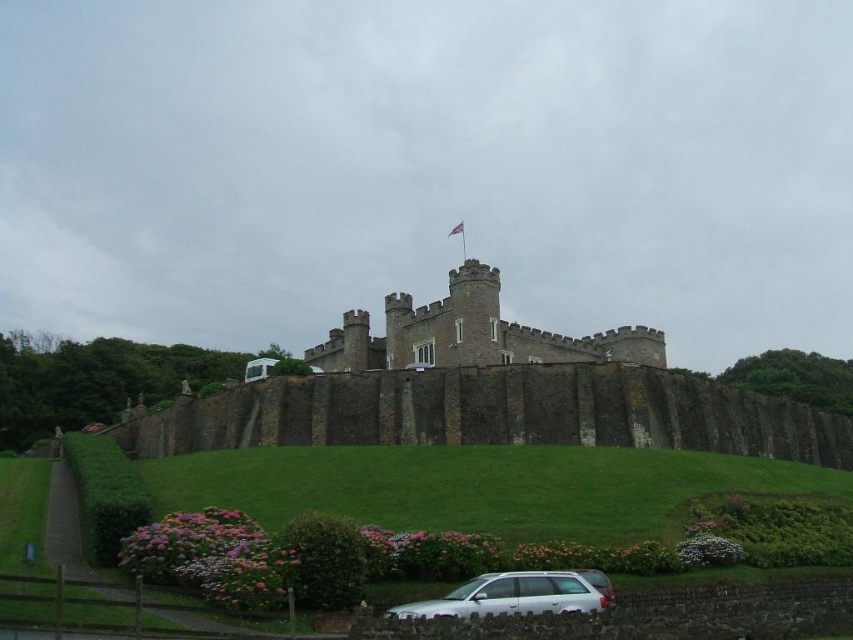
You are a tour guide giving a tour of the castle. You want to inform your group about the distance between the smooth stone castle at center and the white matte station wagon at lower center. How far apart are they?

The smooth stone castle at center is 178.27 feet away from the white matte station wagon at lower center.

You are a visitor arriving at the castle and see the smooth stone castle at center and the white matte station wagon at lower center. Which direction should you drive your car to park closer to the castle?

You should drive your car to the right since the smooth stone castle at center is located to the right of the white matte station wagon at lower center, so moving in that direction will bring you closer to the castle.

You are a visitor arriving at the castle and notice the smooth stone castle at center and the white matte station wagon at lower center. Which object is closer to you from your current viewpoint?

The white matte station wagon at lower center is closer to you because the smooth stone castle at center is positioned over it, indicating it is further away.